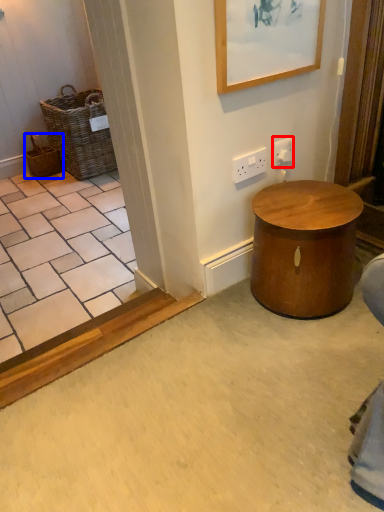
Question: Among these objects, which one is farthest to the camera, electric outlet (highlighted by a red box) or basket (highlighted by a blue box)?

Choices:
 (A) electric outlet
 (B) basket

Answer: (B)